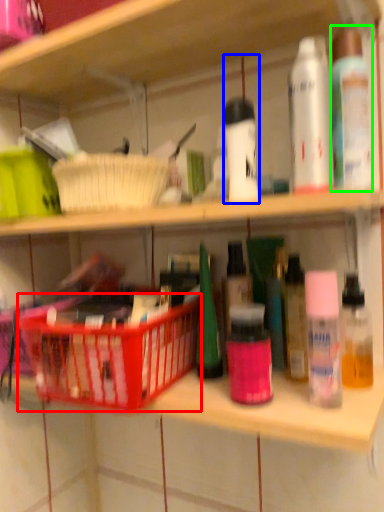
Question: Considering the real-world distances, which object is farthest from basket (highlighted by a red box)? toiletry (highlighted by a blue box) or toiletry (highlighted by a green box)?

Choices:
 (A) toiletry
 (B) toiletry

Answer: (B)